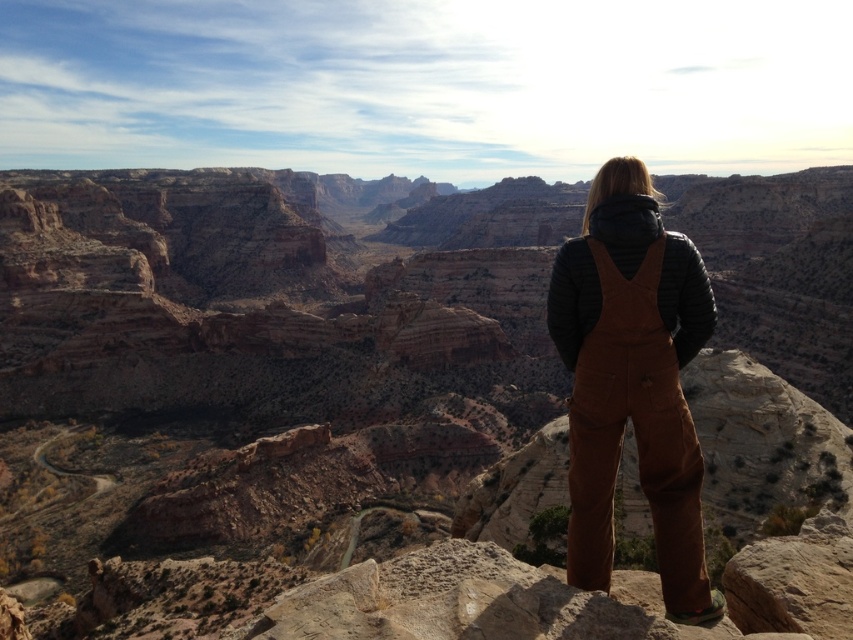
Is the position of brown rock canyon at center less distant than that of brown cotton overalls at center?

Yes, it is.

Does point (793, 209) lie behind point (675, 608)?

Yes, it is behind point (675, 608).

Where is `brown rock canyon at center`? The height and width of the screenshot is (640, 853). brown rock canyon at center is located at coordinates (381, 416).